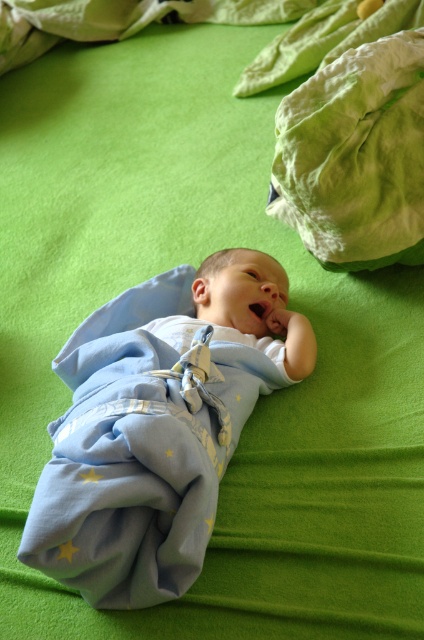
Question: Observing the image, what is the correct spatial positioning of blue soft swaddle at center in reference to green cotton cloth at upper right?

Choices:
 (A) left
 (B) right

Answer: (A)

Question: Can you confirm if blue soft swaddle at center is positioned to the left of green cotton cloth at upper right?

Choices:
 (A) no
 (B) yes

Answer: (B)

Question: Where is blue soft swaddle at center located in relation to green cotton cloth at upper right in the image?

Choices:
 (A) right
 (B) left

Answer: (B)